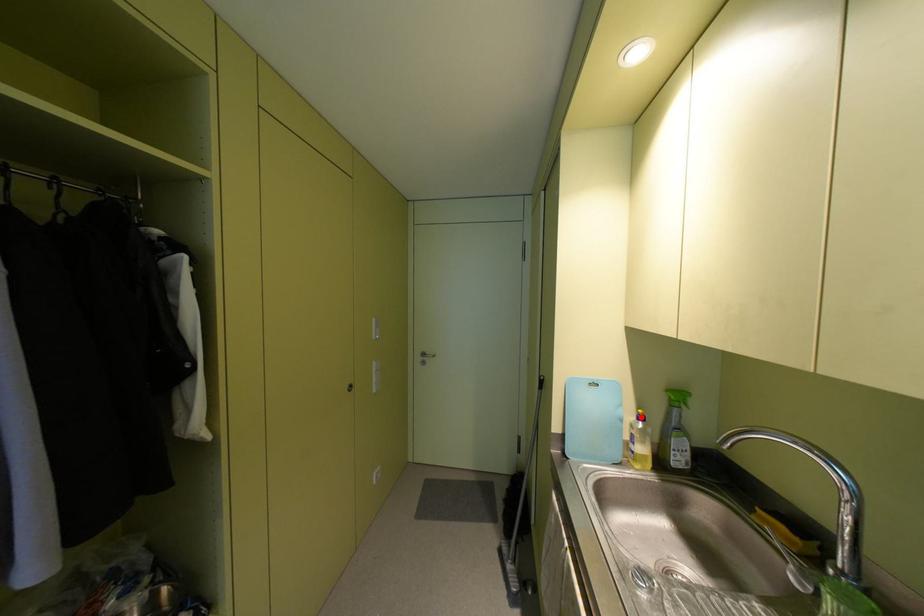
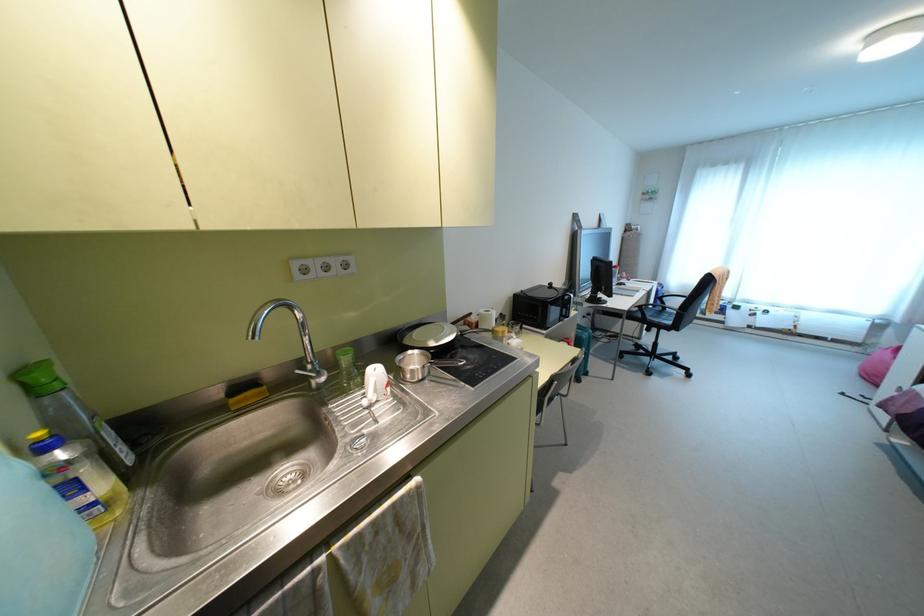
Locate, in the second image, the point that corresponds to the highlighted location in the first image.

(43, 447)